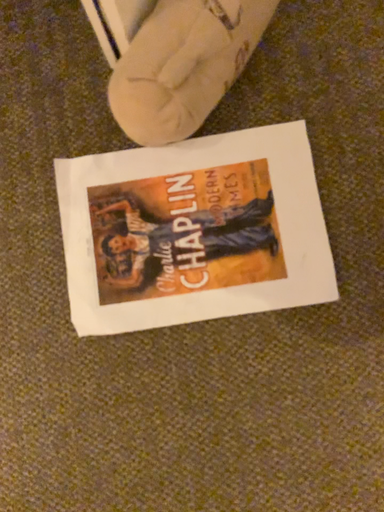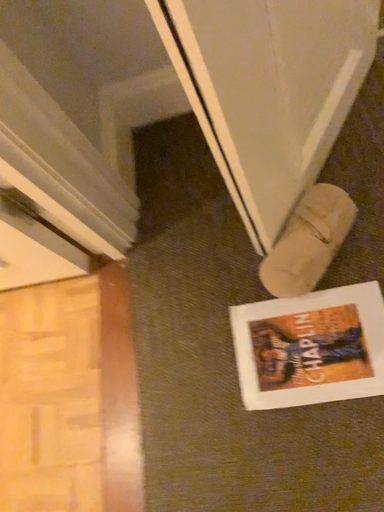
Question: Which way did the camera rotate in the video?

Choices:
 (A) rotated upward
 (B) rotated downward

Answer: (A)